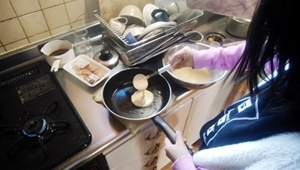
Locate an element on the screen. The width and height of the screenshot is (300, 170). drawer handles is located at coordinates (155, 136), (157, 148), (155, 158), (155, 166).